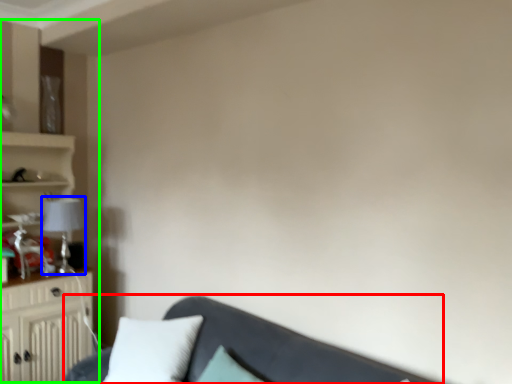
Question: Which object is the farthest from studio couch (highlighted by a red box)? Choose among these: lamp (highlighted by a blue box) or entertainment center (highlighted by a green box).

Choices:
 (A) lamp
 (B) entertainment center

Answer: (B)